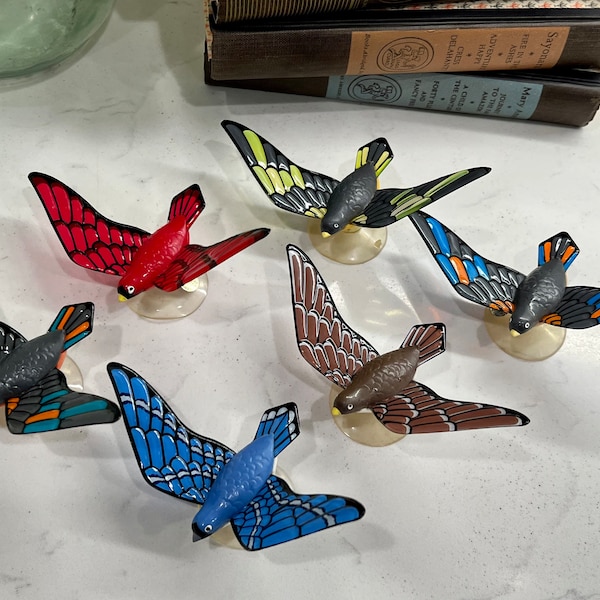
Where is `three books`? Image resolution: width=600 pixels, height=600 pixels. three books is located at coordinates (313, 51).